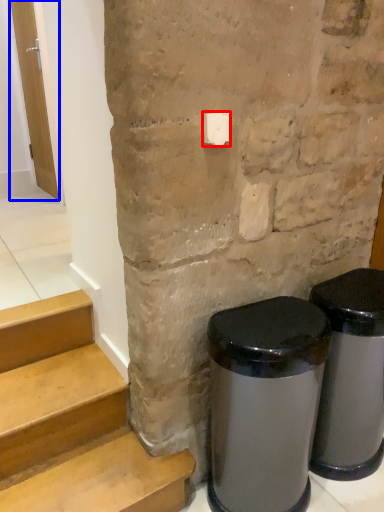
Question: Among these objects, which one is nearest to the camera, light switch (highlighted by a red box) or door (highlighted by a blue box)?

Choices:
 (A) light switch
 (B) door

Answer: (A)